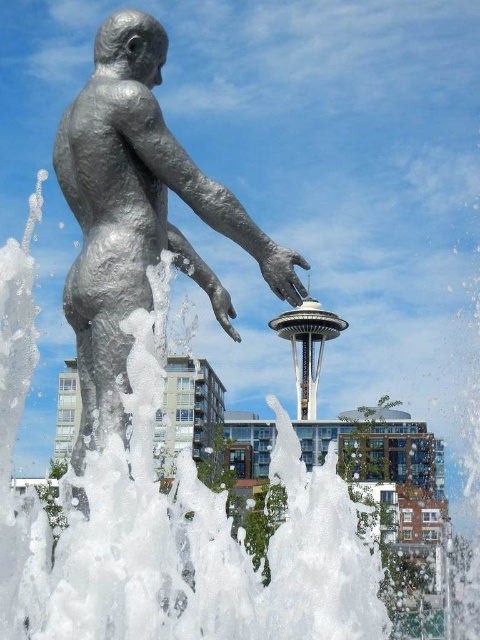
Is point (129, 348) farther from camera compared to point (292, 358)?

No.

In the scene shown: Between shiny silver statue at center and white metallic tower at center, which one appears on the right side from the viewer's perspective?

white metallic tower at center

What do you see at coordinates (136, 216) in the screenshot?
I see `shiny silver statue at center` at bounding box center [136, 216].

Where is `shiny silver statue at center`? The image size is (480, 640). shiny silver statue at center is located at coordinates (136, 216).